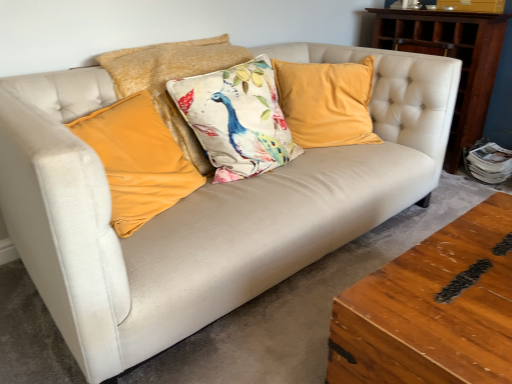
Question: From a real-world perspective, is velvet peacock pillow at center, the 3th pillow when ordered from left to right, above or below velvet mustard pillow at left, placed as the first pillow when sorted from left to right?

Choices:
 (A) below
 (B) above

Answer: (B)

Question: From the image's perspective, is velvet peacock pillow at center, the 3th pillow when ordered from left to right, positioned above or below velvet mustard pillow at left, the 4th pillow viewed from the right?

Choices:
 (A) below
 (B) above

Answer: (B)

Question: Considering the real-world distances, which object is closest to the wooden coffee table at lower right?

Choices:
 (A) velvet peacock pillow at center, the 3th pillow when ordered from left to right
 (B) velvet mustard pillow at left, placed as the first pillow when sorted from left to right
 (C) velvet yellow pillow at center, positioned as the second pillow in left-to-right order
 (D) velvet yellow pillow at center, the fourth pillow positioned from the left
 (E) wooden dresser at right

Answer: (B)

Question: Based on their relative distances, which object is farther from the velvet yellow pillow at center, positioned as the second pillow in left-to-right order?

Choices:
 (A) wooden coffee table at lower right
 (B) velvet mustard pillow at left, the 4th pillow viewed from the right
 (C) wooden dresser at right
 (D) velvet yellow pillow at center, the fourth pillow positioned from the left
 (E) velvet peacock pillow at center, which is counted as the 2th pillow, starting from the right

Answer: (C)